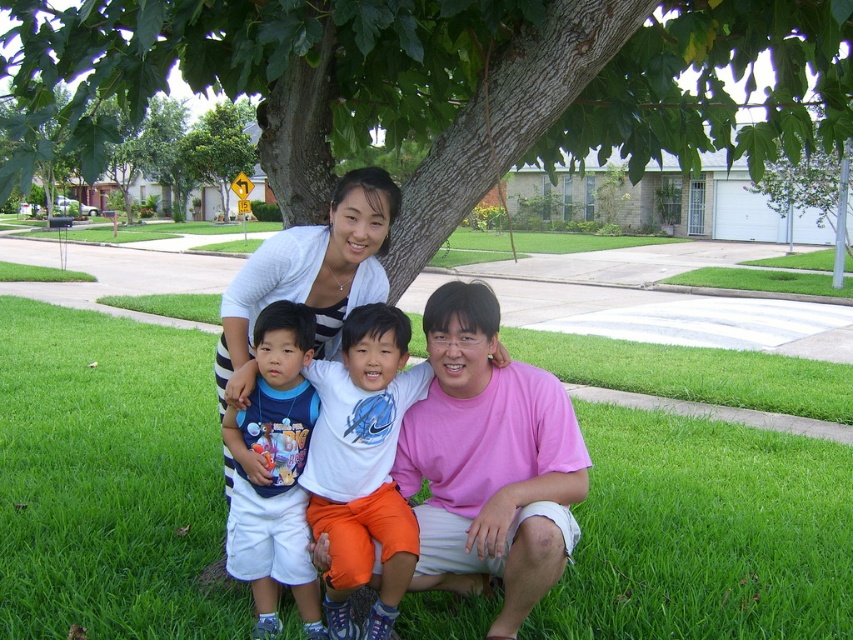
Question: Is green grass at lower center closer to the viewer compared to white striped shirt at upper center?

Choices:
 (A) no
 (B) yes

Answer: (A)

Question: Which of the following is the farthest from the observer?

Choices:
 (A) (222, 141)
 (B) (747, 44)

Answer: (A)

Question: Which point is closer to the camera taking this photo?

Choices:
 (A) (256, 552)
 (B) (291, 256)
 (C) (390, 355)

Answer: (C)

Question: Does green grass at lower center have a smaller size compared to white cotton shirt at center?

Choices:
 (A) yes
 (B) no

Answer: (B)

Question: Considering the real-world distances, which object is farthest from the blue cotton shirt at center?

Choices:
 (A) green leafy tree at upper left
 (B) green grass at lower center
 (C) green leafy tree at center

Answer: (A)

Question: Does green leafy tree at center come in front of blue cotton shirt at center?

Choices:
 (A) no
 (B) yes

Answer: (A)